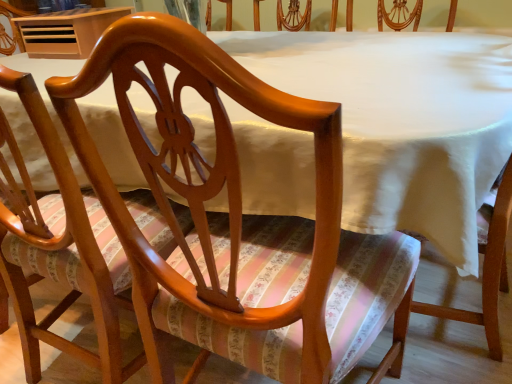
Question: Is glossy wood chair at center, the first chair viewed from the right, shorter than glossy wood chair at center, placed as the 1th chair when sorted from left to right?

Choices:
 (A) no
 (B) yes

Answer: (B)

Question: Would you consider glossy wood chair at center, the first chair viewed from the right, to be distant from glossy wood chair at center, arranged as the 2th chair when viewed from the right?

Choices:
 (A) yes
 (B) no

Answer: (B)

Question: Is glossy wood chair at center, the first chair viewed from the right, touching glossy wood chair at center, arranged as the 2th chair when viewed from the right?

Choices:
 (A) no
 (B) yes

Answer: (A)

Question: From a real-world perspective, is glossy wood chair at center, the 2th chair in the left-to-right sequence, over glossy wood chair at center, arranged as the 2th chair when viewed from the right?

Choices:
 (A) no
 (B) yes

Answer: (B)

Question: Does glossy wood chair at center, the 2th chair in the left-to-right sequence, appear on the right side of glossy wood chair at center, arranged as the 2th chair when viewed from the right?

Choices:
 (A) yes
 (B) no

Answer: (A)

Question: Does glossy wood chair at center, the first chair viewed from the right, have a larger size compared to glossy wood chair at center, arranged as the 2th chair when viewed from the right?

Choices:
 (A) no
 (B) yes

Answer: (B)

Question: From the image's perspective, is glossy wood chair at center, placed as the 1th chair when sorted from left to right, on top of glossy wood chair at center, the first chair viewed from the right?

Choices:
 (A) no
 (B) yes

Answer: (B)

Question: Can you confirm if glossy wood chair at center, placed as the 1th chair when sorted from left to right, is wider than glossy wood chair at center, the first chair viewed from the right?

Choices:
 (A) yes
 (B) no

Answer: (B)

Question: Are glossy wood chair at center, arranged as the 2th chair when viewed from the right, and glossy wood chair at center, the first chair viewed from the right, beside each other?

Choices:
 (A) yes
 (B) no

Answer: (B)

Question: Is glossy wood chair at center, arranged as the 2th chair when viewed from the right, surrounding glossy wood chair at center, the 2th chair in the left-to-right sequence?

Choices:
 (A) no
 (B) yes

Answer: (A)

Question: Does glossy wood chair at center, placed as the 1th chair when sorted from left to right, have a lesser width compared to glossy wood chair at center, the 2th chair in the left-to-right sequence?

Choices:
 (A) yes
 (B) no

Answer: (A)

Question: Is glossy wood chair at center, arranged as the 2th chair when viewed from the right, facing away from glossy wood chair at center, the first chair viewed from the right?

Choices:
 (A) no
 (B) yes

Answer: (A)

Question: Is glossy wood chair at center, arranged as the 2th chair when viewed from the right, positioned behind wooden table at upper left?

Choices:
 (A) no
 (B) yes

Answer: (A)